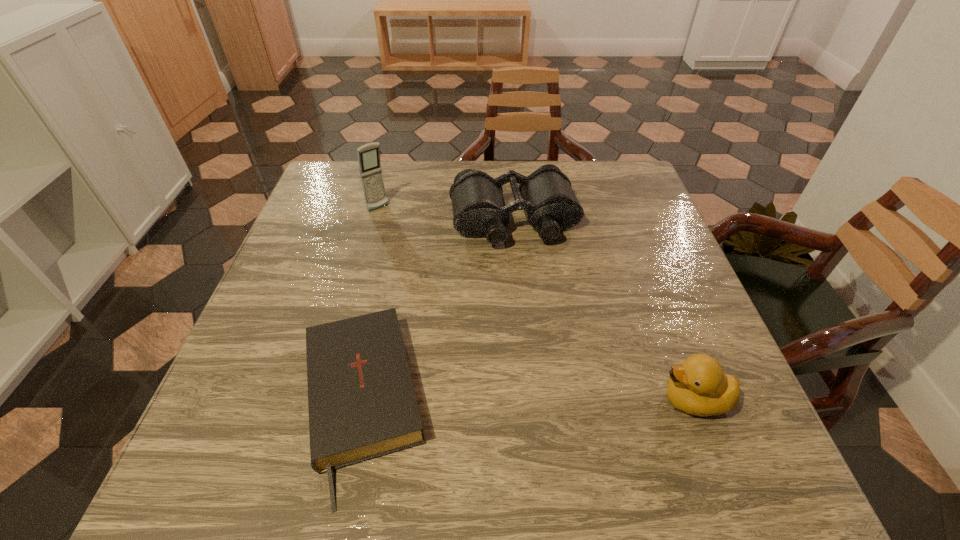
You are a GUI agent. You are given a task and a screenshot of the screen. Output one action in this format:
    pyautogui.click(x=<x>, y=<y>)
    Task: Click on the object present at the near left corner
    
    Given the screenshot: What is the action you would take?
    pyautogui.click(x=362, y=405)

Where is `object located in the near right corner section of the desktop`? This screenshot has width=960, height=540. object located in the near right corner section of the desktop is located at coordinates (698, 386).

Locate an element on the screen. vacant space at the far edge of the desktop is located at coordinates (398, 184).

This screenshot has width=960, height=540. In the image, there is a desktop. Find the location of `free space at the near edge`. free space at the near edge is located at coordinates (576, 389).

In the image, there is a desktop. Where is `vacant space at the left edge`? This screenshot has width=960, height=540. vacant space at the left edge is located at coordinates (304, 245).

Find the location of `vacant region at the right edge of the desktop`. vacant region at the right edge of the desktop is located at coordinates (690, 317).

The image size is (960, 540). I want to click on free space at the far left corner of the desktop, so click(x=340, y=195).

Where is `blank space at the far right corner of the desktop`? This screenshot has height=540, width=960. blank space at the far right corner of the desktop is located at coordinates (639, 174).

Locate an element on the screen. This screenshot has width=960, height=540. free space between the rightmost object and the tallest object is located at coordinates (536, 305).

The image size is (960, 540). In order to click on free space between the rightmost object and the Bible in this screenshot , I will do `click(527, 402)`.